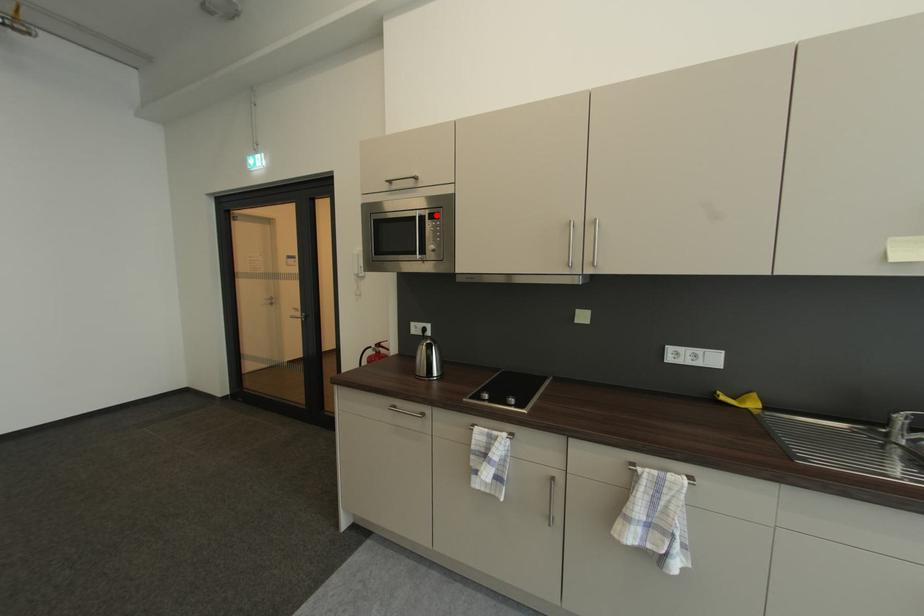
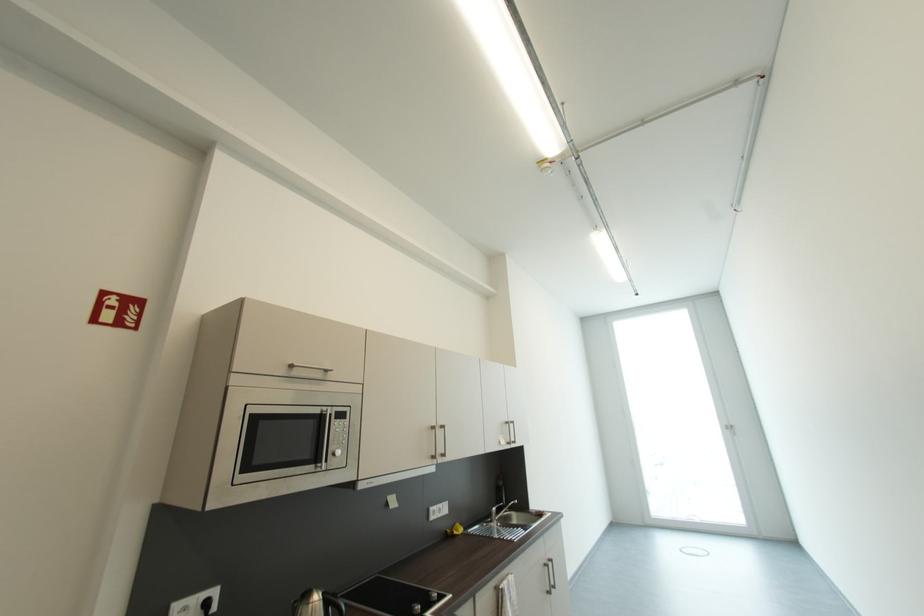
Find the pixel in the second image that matches the highlighted location in the first image.

(342, 413)